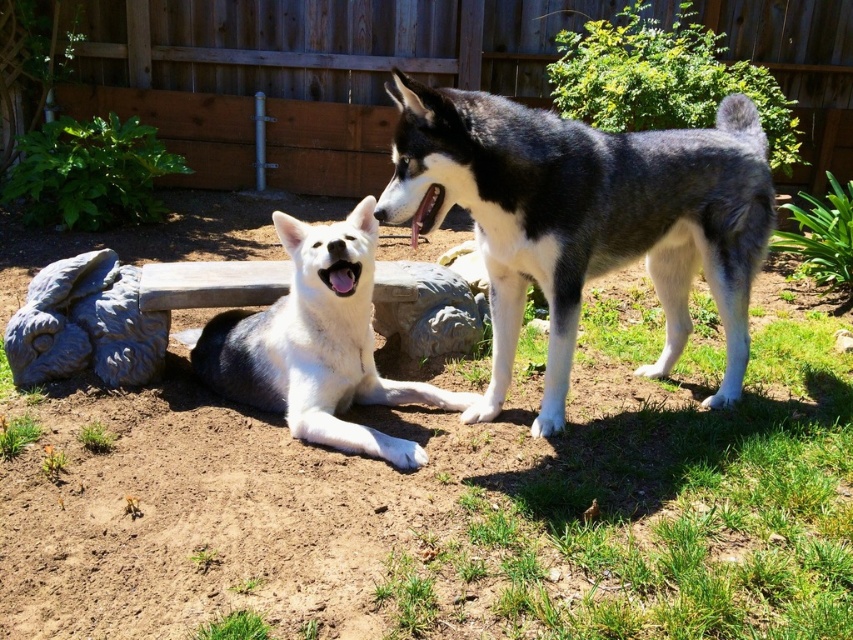
You are standing in the backyard and want to place a small water bowl for the dogs. If you place the bowl at point (502,157) and point (321,444), which point is closer to you?

Point (502,157) is closer to the viewer than point (321,444), so placing the bowl at point (502,157) would be closer to you.